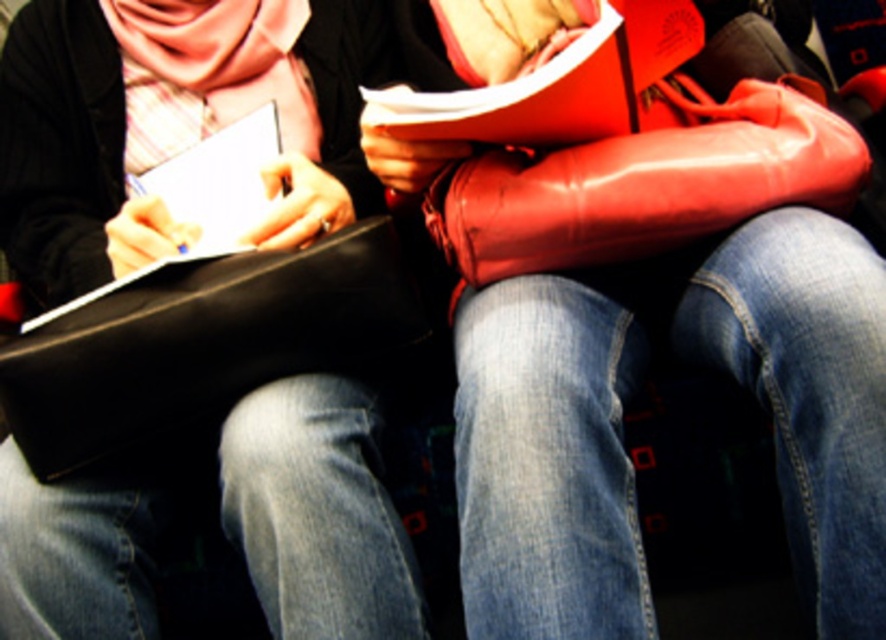
Can you confirm if rubberized red bag at center is wider than glossy leather boot at center?

Correct, the width of rubberized red bag at center exceeds that of glossy leather boot at center.

Does point (835, 300) come behind point (484, 248)?

No, it is not.

Locate an element on the screen. This screenshot has height=640, width=886. rubberized red bag at center is located at coordinates coord(620,422).

Is matte black bag at center thinner than black leather bag at lower left?

No.

The width and height of the screenshot is (886, 640). What do you see at coordinates (175, 122) in the screenshot?
I see `matte black bag at center` at bounding box center [175, 122].

Identify the location of matte black bag at center. (175, 122).

You are a GUI agent. You are given a task and a screenshot of the screen. Output one action in this format:
    pyautogui.click(x=<x>, y=<y>)
    Task: Click on the matte black bag at center
    
    Given the screenshot: What is the action you would take?
    pyautogui.click(x=175, y=122)

Does rubberized red bag at center have a larger size compared to black leather bag at lower left?

Indeed, rubberized red bag at center has a larger size compared to black leather bag at lower left.

The width and height of the screenshot is (886, 640). What do you see at coordinates (620, 422) in the screenshot? I see `rubberized red bag at center` at bounding box center [620, 422].

Identify the location of rubberized red bag at center. The height and width of the screenshot is (640, 886). (620, 422).